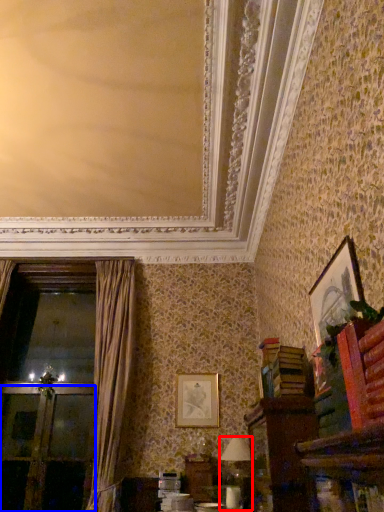
Question: Among these objects, which one is nearest to the camera, table lamp (highlighted by a red box) or screen door (highlighted by a blue box)?

Choices:
 (A) table lamp
 (B) screen door

Answer: (A)